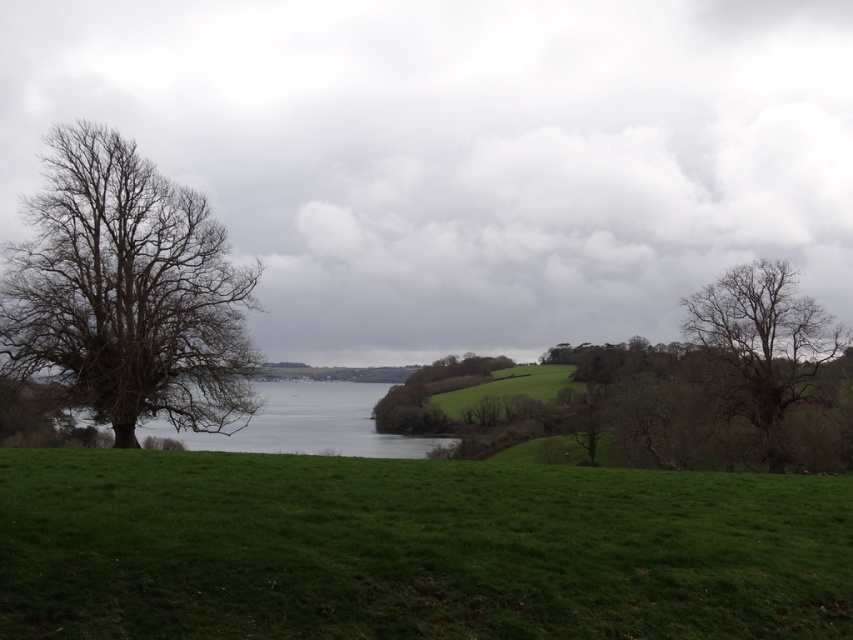
Is bare branches at left above gray water at center?

Indeed, bare branches at left is positioned over gray water at center.

Does bare branches at left appear on the right side of gray water at center?

No, bare branches at left is not to the right of gray water at center.

What do you see at coordinates (126, 292) in the screenshot? I see `bare branches at left` at bounding box center [126, 292].

This screenshot has width=853, height=640. Identify the location of bare branches at left. (126, 292).

Does green grassy field at lower center come in front of bare branches at left?

Yes, green grassy field at lower center is closer to the viewer.

Is green grassy field at lower center thinner than bare branches at left?

In fact, green grassy field at lower center might be wider than bare branches at left.

Who is more distant from viewer, (503, 492) or (166, 413)?

The point (166, 413) is more distant.

The image size is (853, 640). Identify the location of green grassy field at lower center. [413, 548].

Looking at this image, is green grassy field at lower center below gray water at center?

Actually, green grassy field at lower center is above gray water at center.

Is point (708, 497) farther from viewer compared to point (357, 454)?

No, (708, 497) is in front of (357, 454).

Is point (144, 497) less distant than point (384, 448)?

Yes, point (144, 497) is closer to viewer.

In order to click on green grassy field at lower center in this screenshot , I will do pos(413,548).